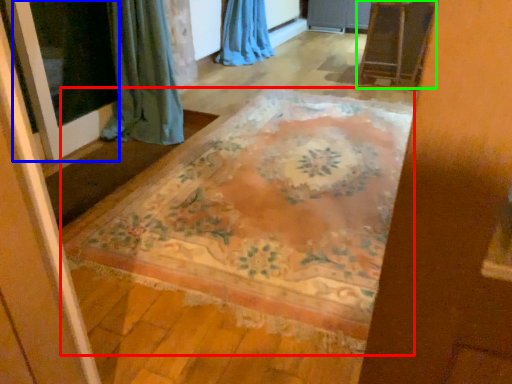
Question: Which object is the farthest from mat (highlighted by a red box)? Choose among these: screen door (highlighted by a blue box) or furniture (highlighted by a green box).

Choices:
 (A) screen door
 (B) furniture

Answer: (B)